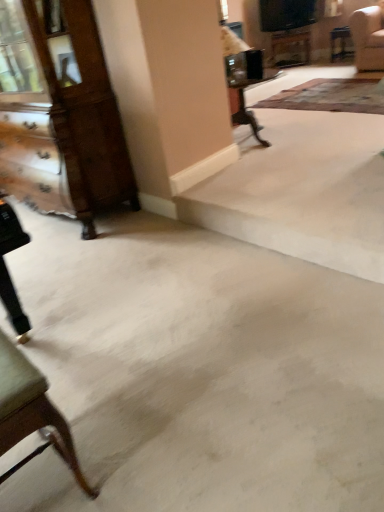
Question: Does wooden table at upper center come in front of wooden dresser at left?

Choices:
 (A) no
 (B) yes

Answer: (A)

Question: From the image's perspective, is wooden table at upper center on wooden dresser at left?

Choices:
 (A) no
 (B) yes

Answer: (B)

Question: Is wooden table at upper center wider than wooden dresser at left?

Choices:
 (A) no
 (B) yes

Answer: (B)

Question: From a real-world perspective, is wooden table at upper center located beneath wooden dresser at left?

Choices:
 (A) no
 (B) yes

Answer: (B)

Question: Is wooden table at upper center outside wooden dresser at left?

Choices:
 (A) no
 (B) yes

Answer: (B)

Question: From a real-world perspective, is wooden table at upper center positioned over wooden dresser at left based on gravity?

Choices:
 (A) no
 (B) yes

Answer: (A)

Question: From a real-world perspective, is patterned carpet at upper right physically below wooden dresser at left?

Choices:
 (A) yes
 (B) no

Answer: (A)

Question: From a real-world perspective, is patterned carpet at upper right physically above wooden dresser at left?

Choices:
 (A) yes
 (B) no

Answer: (B)

Question: Is patterned carpet at upper right smaller than wooden dresser at left?

Choices:
 (A) no
 (B) yes

Answer: (B)

Question: Can you confirm if patterned carpet at upper right is taller than wooden dresser at left?

Choices:
 (A) yes
 (B) no

Answer: (B)

Question: Is patterned carpet at upper right not close to wooden dresser at left?

Choices:
 (A) yes
 (B) no

Answer: (A)

Question: From the image's perspective, is patterned carpet at upper right beneath wooden dresser at left?

Choices:
 (A) no
 (B) yes

Answer: (A)

Question: Is patterned carpet at upper right wider than wooden table at upper center?

Choices:
 (A) no
 (B) yes

Answer: (B)